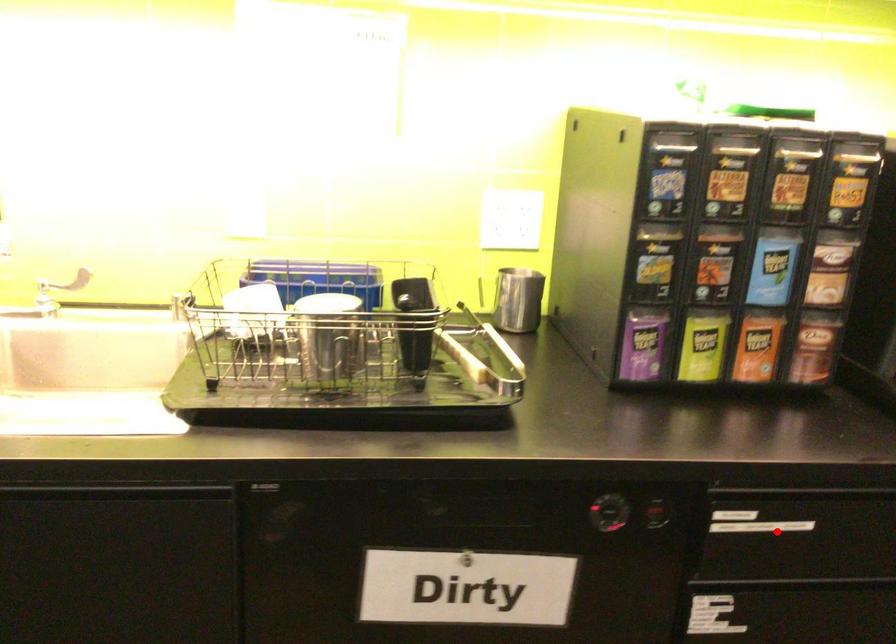
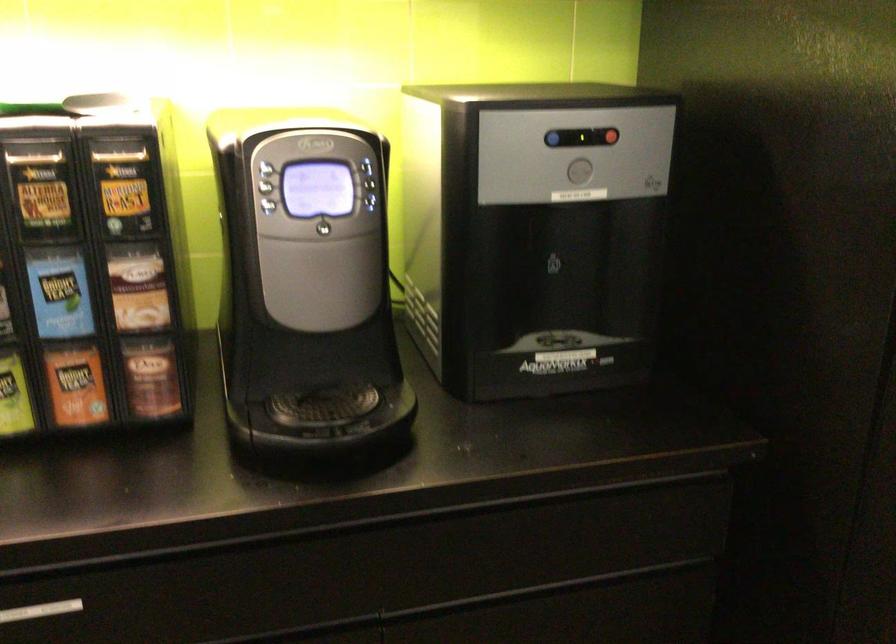
Locate, in the second image, the point that corresponds to the highlighted location in the first image.

(40, 611)